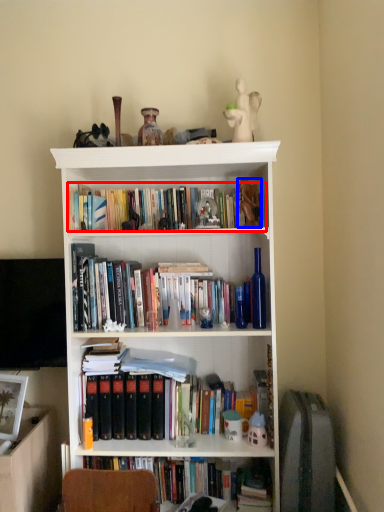
Question: Which object appears farthest to the camera in this image, book (highlighted by a red box) or toy (highlighted by a blue box)?

Choices:
 (A) book
 (B) toy

Answer: (A)